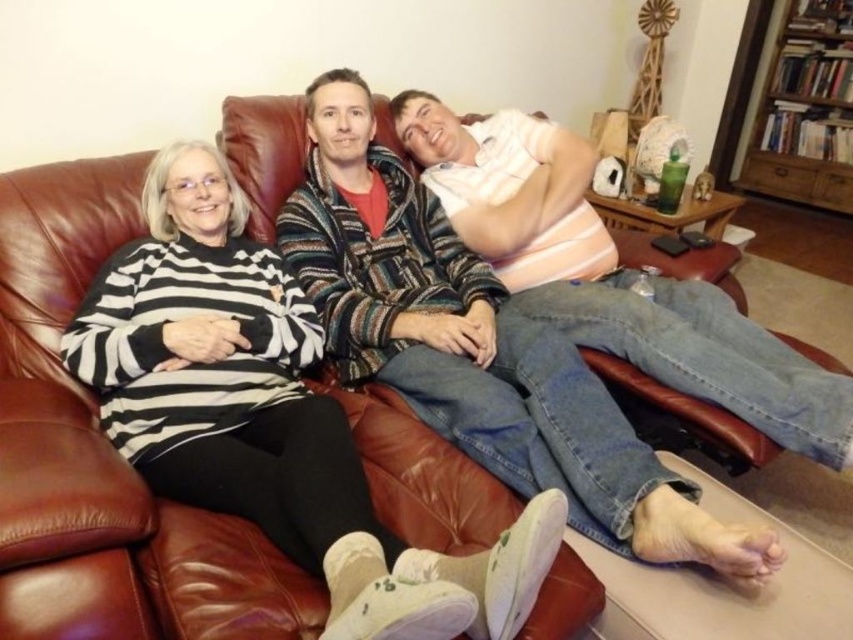
You are a fashion designer observing the three people on the couch. You need to determine which of the two sweaters, the black and white striped sweater at left or the striped sweater at center, is shorter in length. Based on the scene, which one is shorter?

The black and white striped sweater at left has a lesser height compared to the striped sweater at center, so the black and white striped sweater at left is shorter in length.

You are a photographer trying to capture a closeup of the black and white striped sweater at left. You notice a point at coordinates [270,417]. Is this point located on the sweater?

Yes, the point at coordinates [270,417] is located on the black and white striped sweater at left.

You are standing in the living room and want to locate the black and white striped sweater at left. According to the coordinates provided, where should you look?

The black and white striped sweater at left is located at point (270, 417).